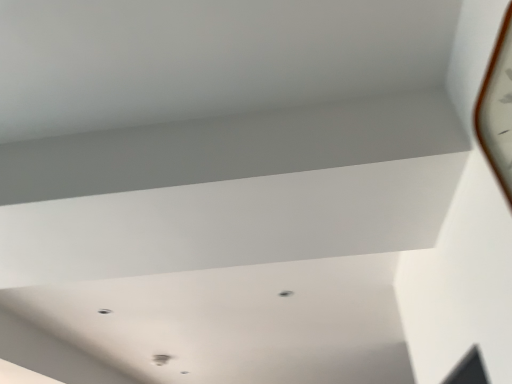
Image resolution: width=512 pixels, height=384 pixels. What do you see at coordinates (497, 109) in the screenshot?
I see `metallic gold clock at upper right` at bounding box center [497, 109].

The height and width of the screenshot is (384, 512). Find the location of `metallic gold clock at upper right`. metallic gold clock at upper right is located at coordinates (497, 109).

I want to click on metallic gold clock at upper right, so click(497, 109).